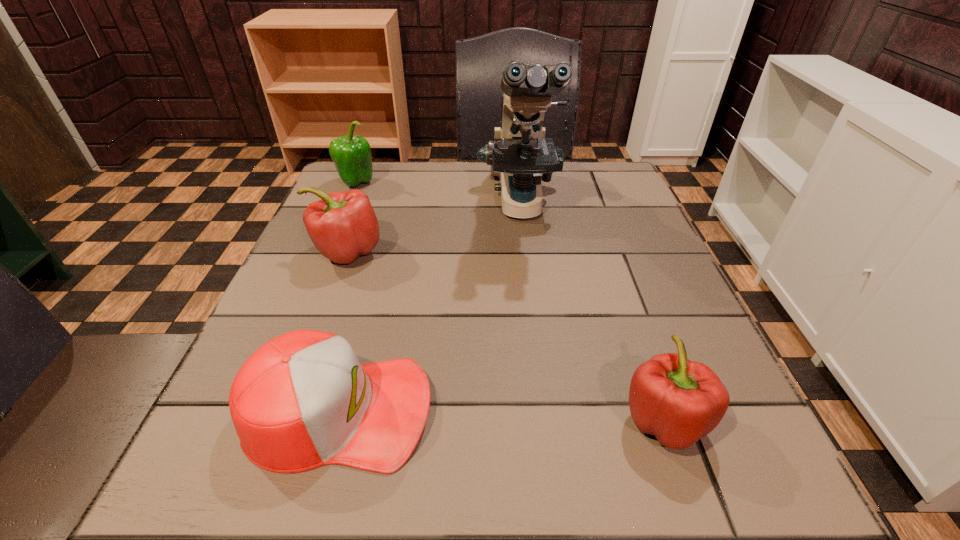
Where is `vacant space that is in between the farthest bell pepper and the baseball cap`? The height and width of the screenshot is (540, 960). vacant space that is in between the farthest bell pepper and the baseball cap is located at coordinates (348, 297).

This screenshot has width=960, height=540. In order to click on free point between the shortest bell pepper and the microscope in this screenshot , I will do `click(592, 312)`.

The width and height of the screenshot is (960, 540). I want to click on free area in between the tallest object and the baseball cap, so click(x=430, y=307).

Image resolution: width=960 pixels, height=540 pixels. Find the location of `vacant region between the farthest bell pepper and the baseball cap`. vacant region between the farthest bell pepper and the baseball cap is located at coordinates (348, 297).

In order to click on free space between the farthest bell pepper and the microscope in this screenshot , I will do `click(439, 194)`.

The width and height of the screenshot is (960, 540). I want to click on vacant region between the baseball cap and the farthest bell pepper, so point(348,297).

I want to click on object that is the third nearest to the second tallest bell pepper, so click(x=302, y=400).

Identify which object is the second nearest to the farthest bell pepper. Please provide its 2D coordinates. Your answer should be formatted as a tuple, i.e. [(x, y)], where the tuple contains the x and y coordinates of a point satisfying the conditions above.

[(519, 153)]

This screenshot has height=540, width=960. Identify the location of bell pepper identified as the second closest to the tallest object. (352, 157).

Select which bell pepper is the third closest to the baseball cap. Please provide its 2D coordinates. Your answer should be formatted as a tuple, i.e. [(x, y)], where the tuple contains the x and y coordinates of a point satisfying the conditions above.

[(352, 157)]